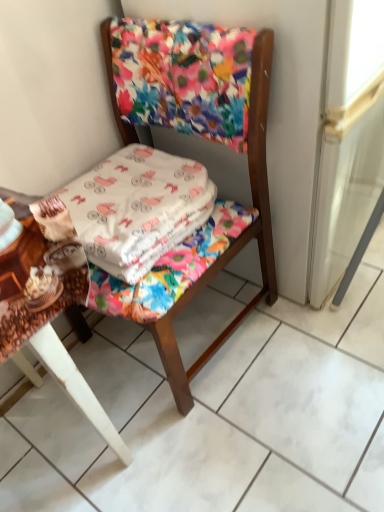
You are a GUI agent. You are given a task and a screenshot of the screen. Output one action in this format:
    pyautogui.click(x=<x>, y=<y>)
    Task: Click on the vacant point to the right of wooden table at lower left
    The image size is (384, 512).
    Given the screenshot: What is the action you would take?
    pyautogui.click(x=229, y=425)